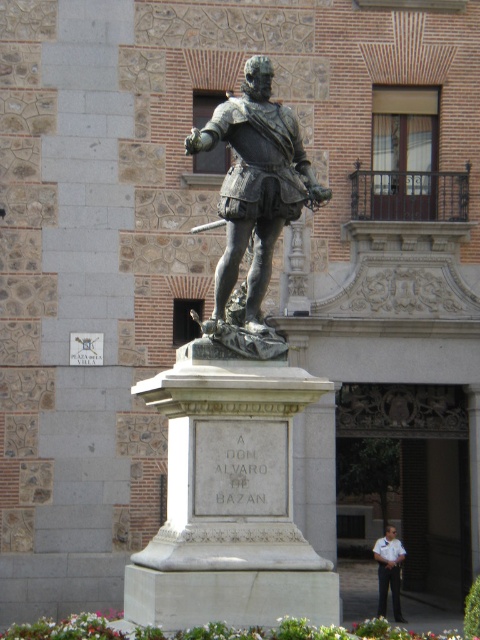
You are standing in front of the statue and want to touch the bronze armor at center and the white uniform at center. Which one can you reach first without moving your position?

The bronze armor at center is closer to the viewer than the white uniform at center, so you can reach the bronze armor at center first without moving your position.

You are a tourist visiting a historical site and see the bronze statue at center and the white uniform at center. According to the scene, which object is located to the left of the other?

The bronze statue at center is positioned on the left side of white uniform at center.